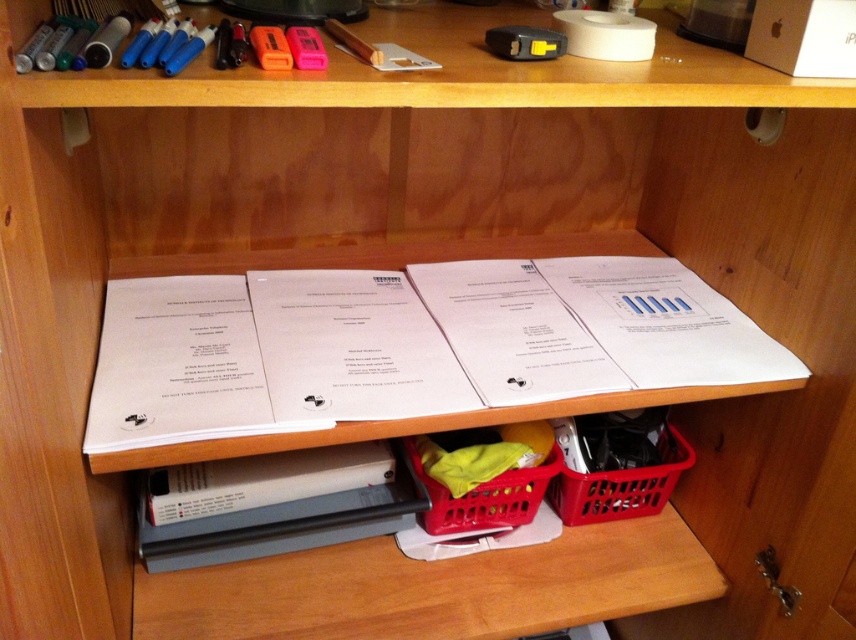
Between red plastic basket at lower center and red plastic basket at center, which one appears on the left side from the viewer's perspective?

Positioned to the left is red plastic basket at center.

Is point (629, 490) farther from camera compared to point (428, 518)?

Yes, it is behind point (428, 518).

Does point (575, 481) come farther from viewer compared to point (536, 490)?

Yes.

Where is `red plastic basket at lower center`? This screenshot has height=640, width=856. red plastic basket at lower center is located at coordinates (620, 486).

Image resolution: width=856 pixels, height=640 pixels. Describe the element at coordinates (434, 588) in the screenshot. I see `wooden shelf at lower center` at that location.

Does point (415, 580) come closer to viewer compared to point (638, 481)?

Yes, it is.

The image size is (856, 640). What are the coordinates of `wooden shelf at lower center` in the screenshot? It's located at (434, 588).

Is wooden shelf at lower center thinner than red plastic basket at center?

In fact, wooden shelf at lower center might be wider than red plastic basket at center.

Does wooden shelf at lower center come in front of red plastic basket at center?

Yes, it is in front of red plastic basket at center.

Between point (265, 634) and point (479, 490), which one is positioned behind?

Point (479, 490)

The image size is (856, 640). Identify the location of wooden shelf at lower center. (434, 588).